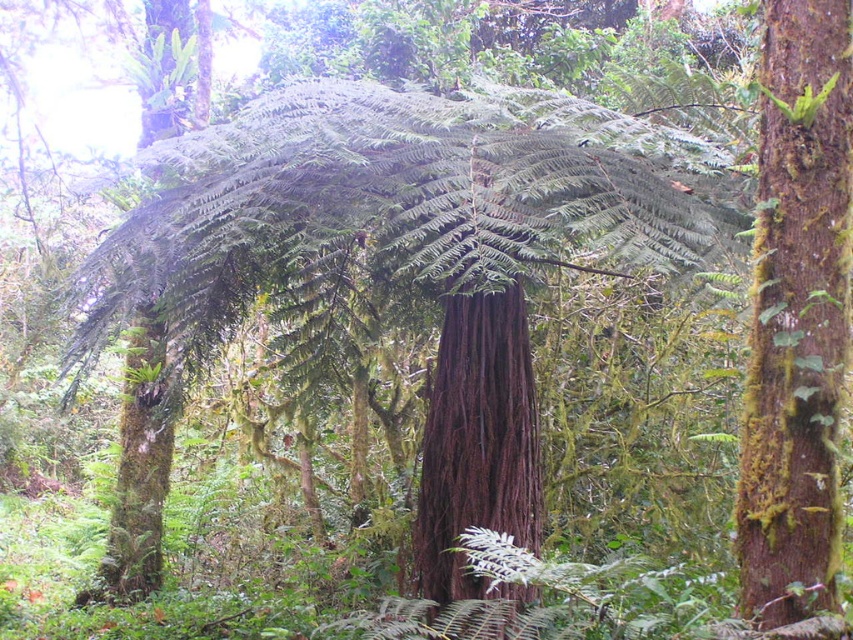
Question: Is brown rough bark at right bigger than dark brown wood at center?

Choices:
 (A) no
 (B) yes

Answer: (A)

Question: Which point is farther to the camera?

Choices:
 (A) (828, 584)
 (B) (521, 467)

Answer: (B)

Question: Can you confirm if brown rough bark at right is thinner than dark brown wood at center?

Choices:
 (A) no
 (B) yes

Answer: (B)

Question: Does brown rough bark at right appear on the right side of dark brown wood at center?

Choices:
 (A) no
 (B) yes

Answer: (B)